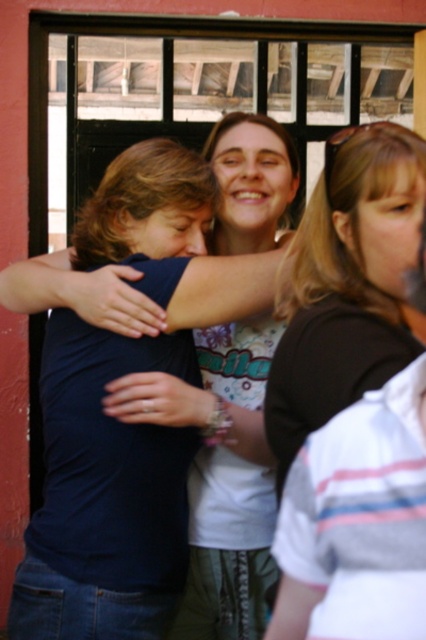
You are a photographer trying to capture a candid shot of the dark blue shirt at center and the matte black shirt at center. Since you want to ensure both subjects are fully visible in the frame, which subject should you position closer to the camera to avoid cropping?

The dark blue shirt at center is much taller than the matte black shirt at center, so positioning the taller dark blue shirt at center closer to the camera will ensure both subjects are fully visible without cropping.

You are standing in the room and want to see the view outside the window through the black metal bars. The matte black shirt at center and white striped shirt at right are blocking your view. Which shirt should you move to get a clearer view of the window?

The white striped shirt at right is behind the matte black shirt at center. To get a clearer view of the window, you should move the white striped shirt at right first since it is farther back and moving it would not obstruct the view as much as moving the front shirt.

You are a photographer standing 5 feet away from the two people in the scene. You want to take a photo that includes both the matte black shirt at center and the white striped shirt at right without any part of them being cut off. What is the minimum width of your camera lens in inches to capture both subjects?

The matte black shirt at center and white striped shirt at right are 34.49 inches apart from each other. To capture both subjects without any part being cut off, the camera lens must be at least 34.49 inches wide.